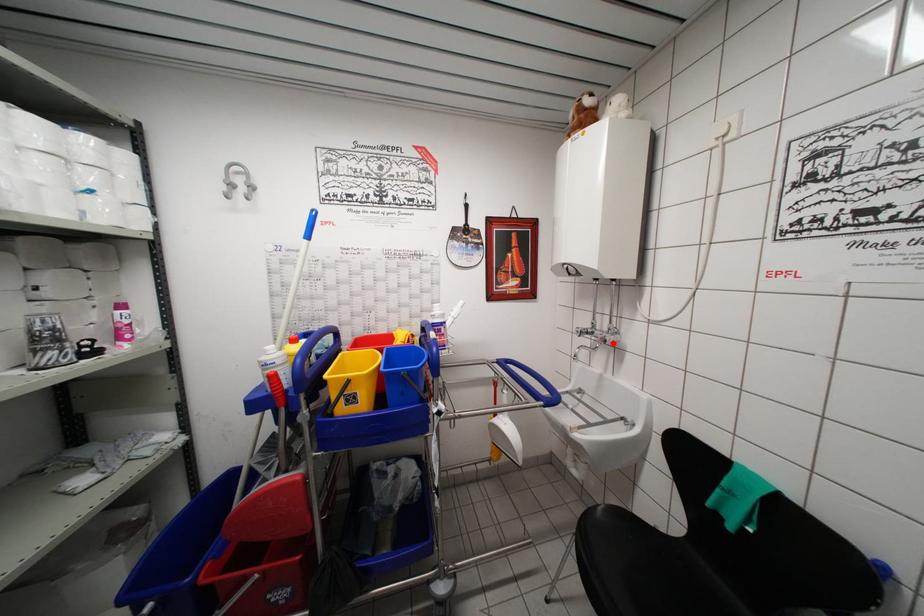
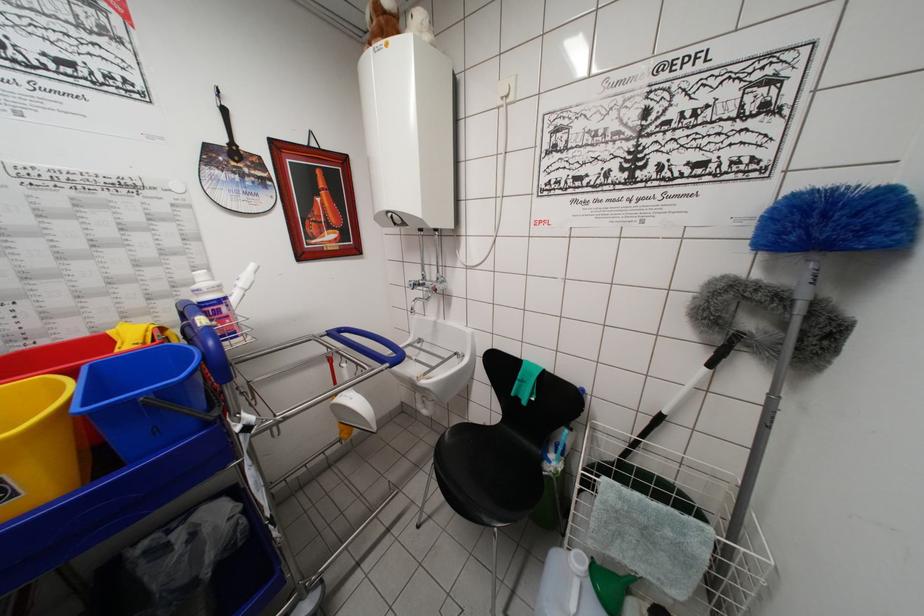
The point at the highlighted location is marked in the first image. Where is the corresponding point in the second image?

(443, 292)